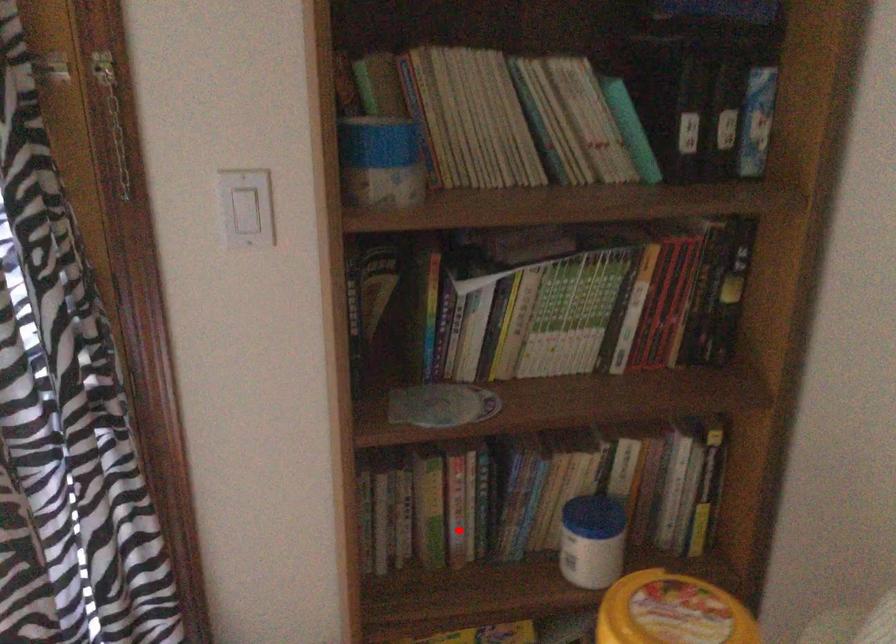
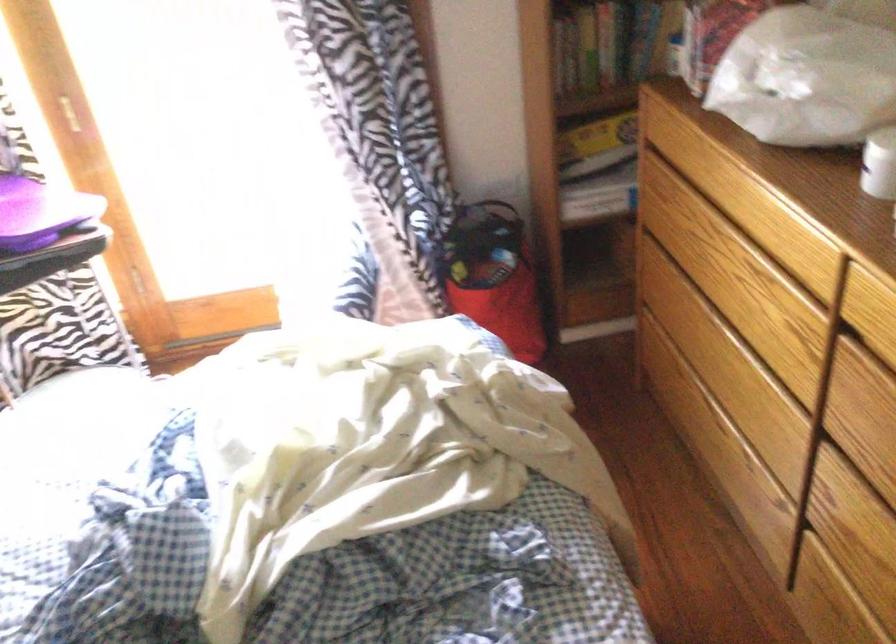
In the second image, find the point that corresponds to the highlighted location in the first image.

(606, 44)